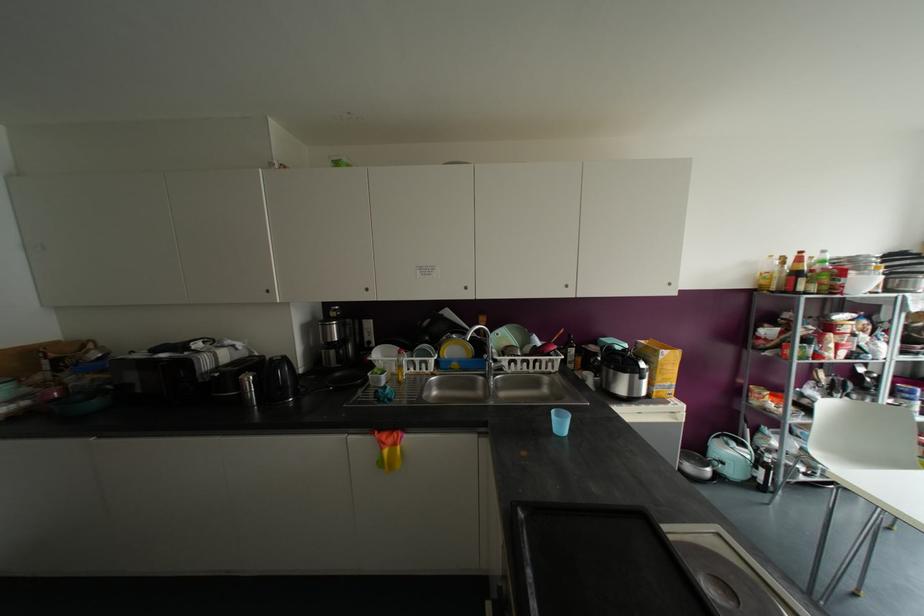
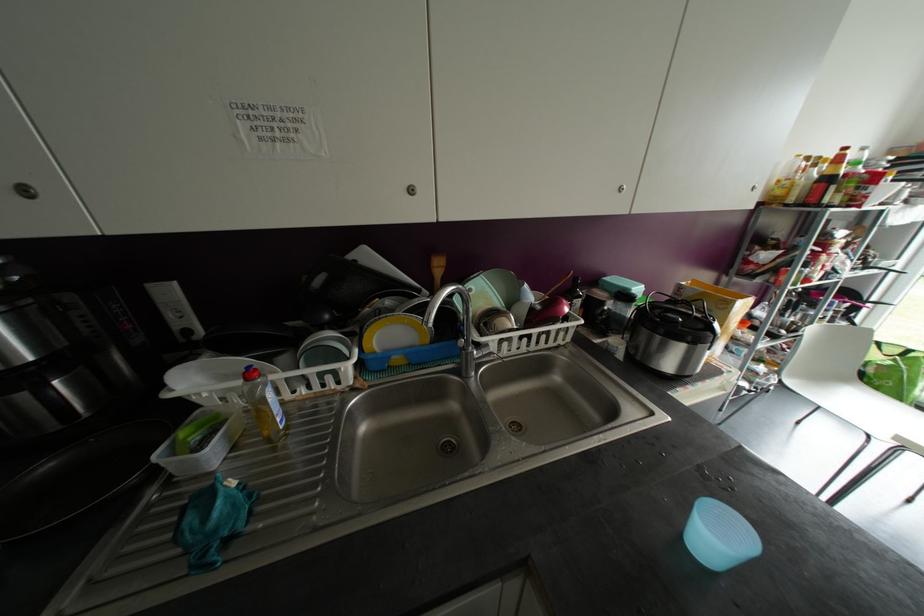
Based on the continuous images, in which direction is the camera rotating?

The camera's rotation is toward right-down.